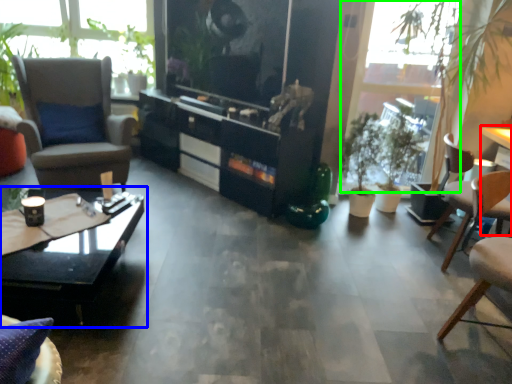
Question: Which is nearer to the table (highlighted by a red box)? coffee table (highlighted by a blue box) or window screen (highlighted by a green box).

Choices:
 (A) coffee table
 (B) window screen

Answer: (B)